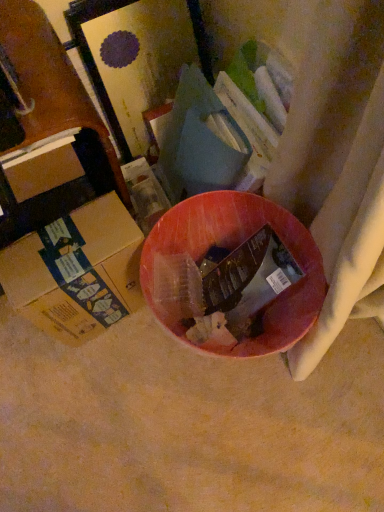
Question: Is brown cardboard box at left, the 2th box ordered from the bottom, completely or partially outside of brown cardboard box at lower left, the second box positioned from the top?

Choices:
 (A) yes
 (B) no

Answer: (A)

Question: Does brown cardboard box at left, the 2th box ordered from the bottom, have a lesser height compared to brown cardboard box at lower left, which is the first box from bottom to top?

Choices:
 (A) no
 (B) yes

Answer: (B)

Question: Can you confirm if brown cardboard box at left, the 2th box ordered from the bottom, is smaller than brown cardboard box at lower left, the second box positioned from the top?

Choices:
 (A) no
 (B) yes

Answer: (B)

Question: From the image's perspective, would you say brown cardboard box at left, the 1th box positioned from the top, is shown under brown cardboard box at lower left, the second box positioned from the top?

Choices:
 (A) yes
 (B) no

Answer: (B)

Question: From the image's perspective, would you say brown cardboard box at left, the 1th box positioned from the top, is positioned over brown cardboard box at lower left, which is the first box from bottom to top?

Choices:
 (A) no
 (B) yes

Answer: (B)

Question: Can you confirm if brown cardboard box at left, the 1th box positioned from the top, is positioned to the right of brown cardboard box at lower left, which is the first box from bottom to top?

Choices:
 (A) yes
 (B) no

Answer: (B)

Question: Is brown cardboard box at lower left, which is the first box from bottom to top, taller than brown cardboard box at left, the 2th box ordered from the bottom?

Choices:
 (A) no
 (B) yes

Answer: (B)

Question: Considering the relative sizes of brown cardboard box at lower left, the second box positioned from the top, and brown cardboard box at left, the 1th box positioned from the top, in the image provided, is brown cardboard box at lower left, the second box positioned from the top, wider than brown cardboard box at left, the 1th box positioned from the top,?

Choices:
 (A) no
 (B) yes

Answer: (B)

Question: Is brown cardboard box at lower left, which is the first box from bottom to top, not inside brown cardboard box at left, the 1th box positioned from the top?

Choices:
 (A) yes
 (B) no

Answer: (A)

Question: Does brown cardboard box at lower left, which is the first box from bottom to top, appear on the right side of brown cardboard box at left, the 2th box ordered from the bottom?

Choices:
 (A) no
 (B) yes

Answer: (B)

Question: From a real-world perspective, is brown cardboard box at lower left, the second box positioned from the top, below brown cardboard box at left, the 2th box ordered from the bottom?

Choices:
 (A) no
 (B) yes

Answer: (B)

Question: Is brown cardboard box at lower left, the second box positioned from the top, turned away from brown cardboard box at left, the 2th box ordered from the bottom?

Choices:
 (A) no
 (B) yes

Answer: (B)

Question: From the image's perspective, is brown cardboard box at lower left, the second box positioned from the top, located above or below brown cardboard box at left, the 2th box ordered from the bottom?

Choices:
 (A) below
 (B) above

Answer: (A)